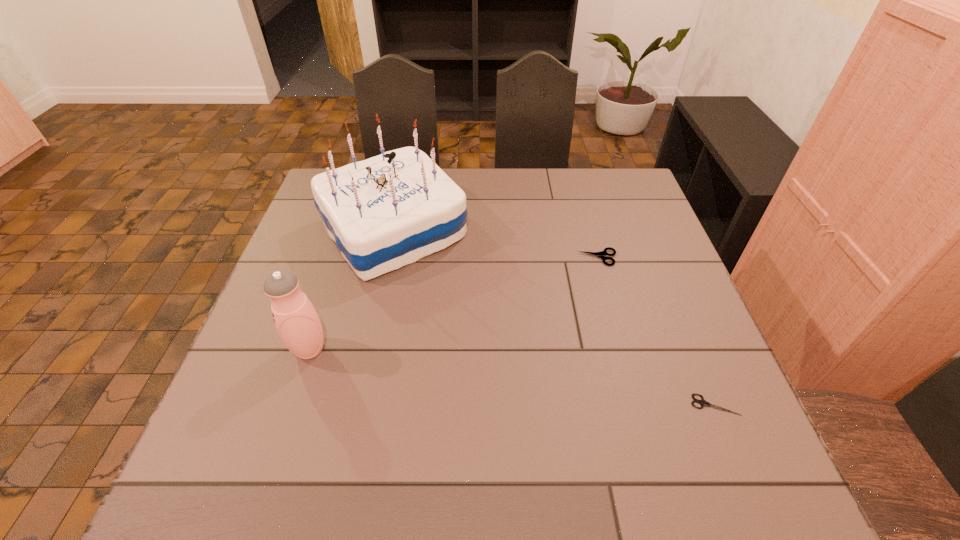
The image size is (960, 540). What are the coordinates of `birthday cake` in the screenshot? It's located at (385, 212).

Where is `the second nearest object`? This screenshot has width=960, height=540. the second nearest object is located at coordinates (297, 322).

At what (x,y) coordinates should I click in order to perform the action: click on the second tallest object. Please return your answer as a coordinate pair (x, y). The width and height of the screenshot is (960, 540). Looking at the image, I should click on (297, 322).

Find the location of a particular element. The width and height of the screenshot is (960, 540). the farther shears is located at coordinates (601, 254).

At what (x,y) coordinates should I click in order to perform the action: click on the second object from right to left. Please return your answer as a coordinate pair (x, y). This screenshot has width=960, height=540. Looking at the image, I should click on (601, 254).

Locate an element on the screen. The height and width of the screenshot is (540, 960). the shorter shears is located at coordinates (702, 402).

The height and width of the screenshot is (540, 960). What are the coordinates of `the nearer shears` in the screenshot? It's located at (702, 402).

At what (x,y) coordinates should I click in order to perform the action: click on blank area located on the right of the tallest object. Please return your answer as a coordinate pair (x, y). Looking at the image, I should click on (511, 231).

Where is `vacant space located on the right of the second tallest object`? This screenshot has height=540, width=960. vacant space located on the right of the second tallest object is located at coordinates (379, 349).

The image size is (960, 540). Find the location of `vacant space located 0.390m on the left of the left shears`. vacant space located 0.390m on the left of the left shears is located at coordinates (431, 258).